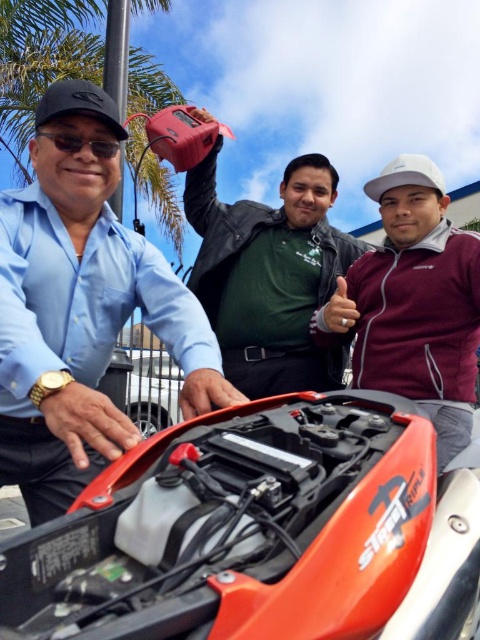
You are a photographer trying to capture a clear shot of the green matte shirt at center. Since the orange matte motorcycle at center is blocking your view, can you move around to the right side to get an unobstructed view?

The orange matte motorcycle at center is closer to the viewer than the green matte shirt at center. Moving to the right side might not help because the motorcycle is still between you and the shirt. You might need to move around to the left side instead to get an unobstructed view.

You are a photographer trying to capture a photo of the orange matte motorcycle at center and the matte black shirt at left. Which object should you focus on first if you want to include both in your shot without moving the camera?

The orange matte motorcycle at center is to the right of the matte black shirt at left, so you should focus on the matte black shirt at left first to ensure both are in frame without moving the camera.

In the scene shown: You are a photographer taking a picture of the motorcycle with its engine compartment open. You notice a point at coordinates (82, 307) on the image. What object is located at this point?

The point at coordinates (82, 307) marks the matte black shirt at left.